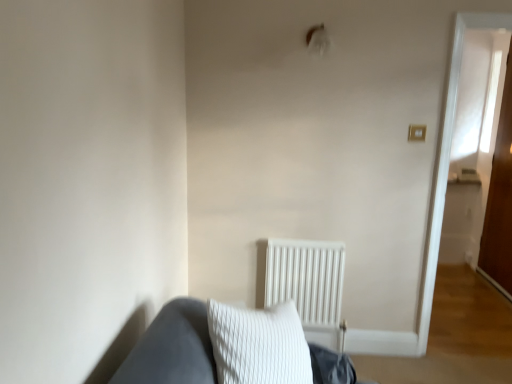
Where is `vacant area that is in front of transparent glass door at right`? The image size is (512, 384). vacant area that is in front of transparent glass door at right is located at coordinates (487, 306).